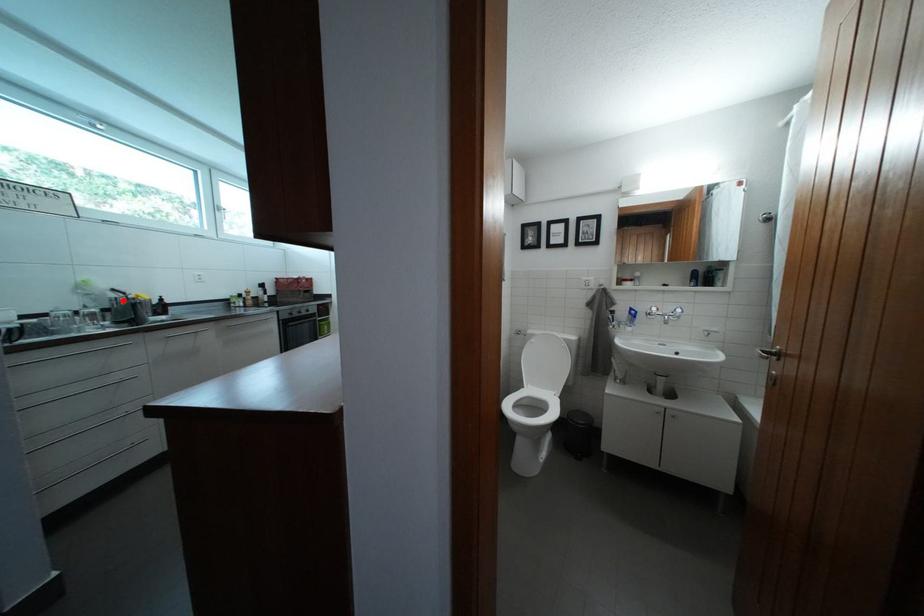
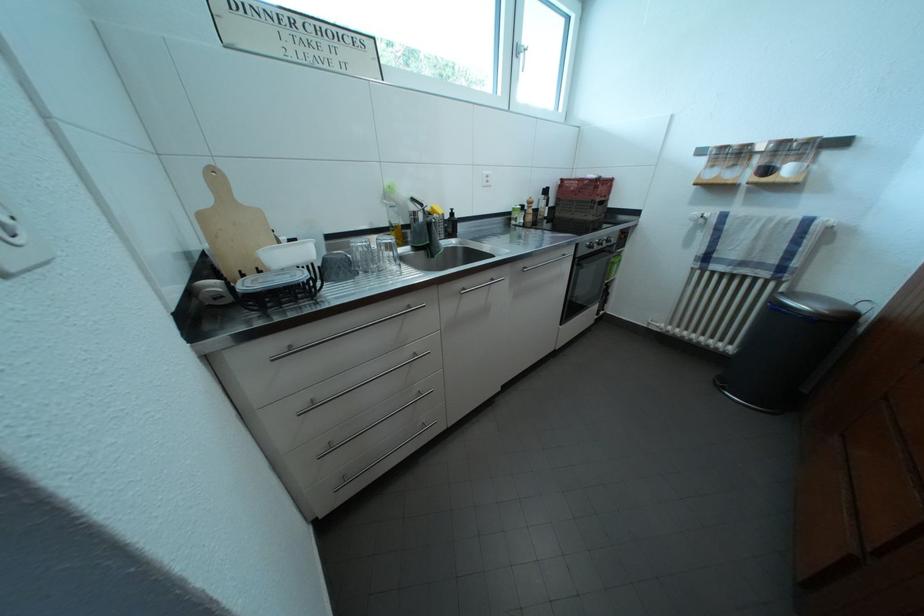
Question: I am providing you with two images of the same scene from different viewpoints. A red point is shown in image1. For the corresponding object point in image2, is it positioned nearer or farther from the camera?

Choices:
 (A) Nearer
 (B) Farther

Answer: (A)